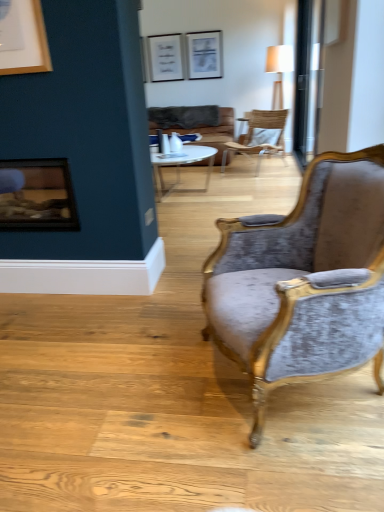
Question: Considering the relative sizes of wooden frame fireplace at left and brown leather couch at center in the image provided, is wooden frame fireplace at left shorter than brown leather couch at center?

Choices:
 (A) yes
 (B) no

Answer: (A)

Question: Is wooden frame fireplace at left further to camera compared to brown leather couch at center?

Choices:
 (A) no
 (B) yes

Answer: (A)

Question: Does wooden frame fireplace at left have a greater height compared to brown leather couch at center?

Choices:
 (A) yes
 (B) no

Answer: (B)

Question: From a real-world perspective, is wooden frame fireplace at left located beneath brown leather couch at center?

Choices:
 (A) no
 (B) yes

Answer: (A)

Question: Does wooden frame fireplace at left touch brown leather couch at center?

Choices:
 (A) yes
 (B) no

Answer: (B)

Question: In the image, is white glass coffee table at center on the left side or the right side of metallic silver picture frame at upper center?

Choices:
 (A) left
 (B) right

Answer: (A)

Question: In terms of width, does white glass coffee table at center look wider or thinner when compared to metallic silver picture frame at upper center?

Choices:
 (A) wide
 (B) thin

Answer: (A)

Question: From the image's perspective, is white glass coffee table at center located above or below metallic silver picture frame at upper center?

Choices:
 (A) below
 (B) above

Answer: (A)

Question: Is point (180, 159) positioned closer to the camera than point (220, 68)?

Choices:
 (A) farther
 (B) closer

Answer: (B)

Question: Is metallic silver picture frame at upper center taller or shorter than white glass coffee table at center?

Choices:
 (A) short
 (B) tall

Answer: (B)

Question: Looking at their shapes, would you say metallic silver picture frame at upper center is wider or thinner than white glass coffee table at center?

Choices:
 (A) wide
 (B) thin

Answer: (B)

Question: Visually, is metallic silver picture frame at upper center positioned to the left or to the right of white glass coffee table at center?

Choices:
 (A) left
 (B) right

Answer: (B)

Question: Based on their sizes in the image, would you say metallic silver picture frame at upper center is bigger or smaller than white glass coffee table at center?

Choices:
 (A) small
 (B) big

Answer: (A)

Question: Is point (331, 281) positioned closer to the camera than point (182, 128)?

Choices:
 (A) farther
 (B) closer

Answer: (B)

Question: Considering their positions, is velvet grey chair at center, which is the first chair from bottom to top, located in front of or behind brown leather couch at center?

Choices:
 (A) behind
 (B) front

Answer: (B)